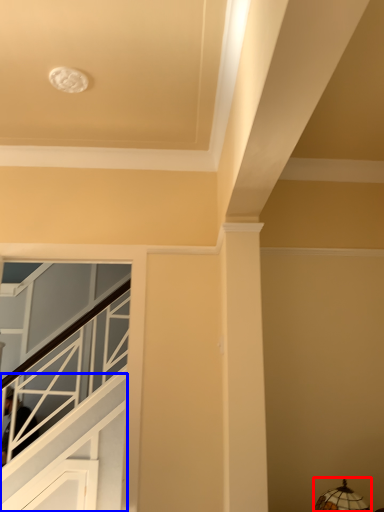
Question: Among these objects, which one is farthest to the camera, lamp (highlighted by a red box) or stairwell (highlighted by a blue box)?

Choices:
 (A) lamp
 (B) stairwell

Answer: (B)